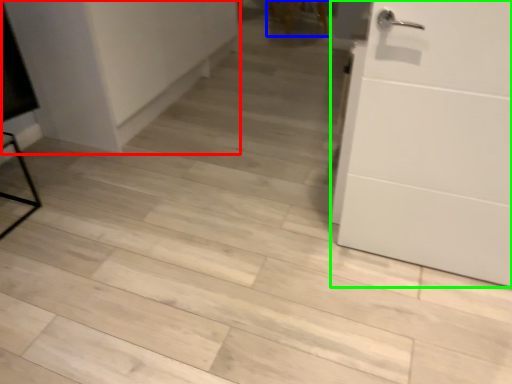
Question: Estimate the real-world distances between objects in this image. Which object is closer to cabinetry (highlighted by a red box), chair (highlighted by a blue box) or door (highlighted by a green box)?

Choices:
 (A) chair
 (B) door

Answer: (B)